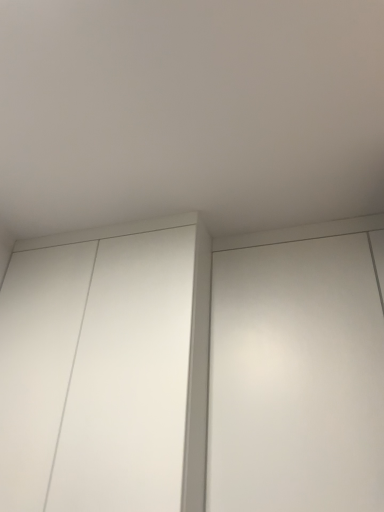
Question: From the image's perspective, is white matte cupboard at center located above or below white matte elevator at right?

Choices:
 (A) above
 (B) below

Answer: (B)

Question: Is white matte cupboard at center in front of or behind white matte elevator at right in the image?

Choices:
 (A) behind
 (B) front

Answer: (A)

Question: Considering the positions of white matte cupboard at center and white matte elevator at right in the image, is white matte cupboard at center taller or shorter than white matte elevator at right?

Choices:
 (A) short
 (B) tall

Answer: (B)

Question: Do you think white matte elevator at right is within white matte cupboard at center, or outside of it?

Choices:
 (A) outside
 (B) inside

Answer: (A)

Question: In terms of size, does white matte elevator at right appear bigger or smaller than white matte cupboard at center?

Choices:
 (A) big
 (B) small

Answer: (B)

Question: In the image, is white matte elevator at right positioned in front of or behind white matte cupboard at center?

Choices:
 (A) front
 (B) behind

Answer: (A)

Question: From a real-world perspective, is white matte elevator at right above or below white matte cupboard at center?

Choices:
 (A) above
 (B) below

Answer: (A)